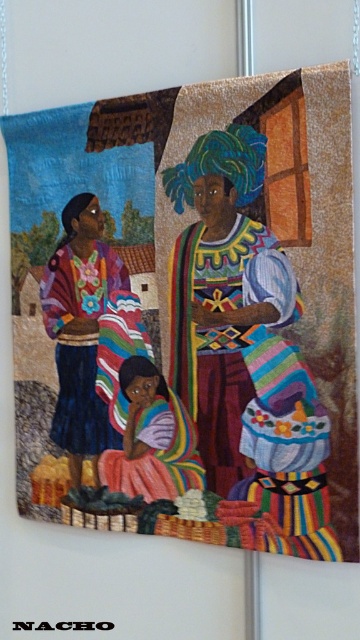
You are an observer looking at the textile artwork. You notice the matte floral blouse at left and the multicolored fabric at center. Which one is positioned higher in the artwork?

The matte floral blouse at left is positioned higher than the multicolored fabric at center.

You are an artisan working on a textile project and need to place a decorative button between the multicolored woven fabric at center and the matte floral blouse at left. The button has a diameter of 0.5 inches. Is there enough space between them to fit the button without overlapping?

The multicolored woven fabric at center and matte floral blouse at left are 4.17 inches apart from each other. Since the button has a diameter of 0.5 inches, there is sufficient space between them to place the button without overlapping.

You are examining the textile artwork and notice two points marked on the child. One is at coordinate point (234, 340) and the other at point (125, 378). Which point is closer to your viewpoint as you look at the artwork?

Point (234, 340) is closer to the camera than point (125, 378).